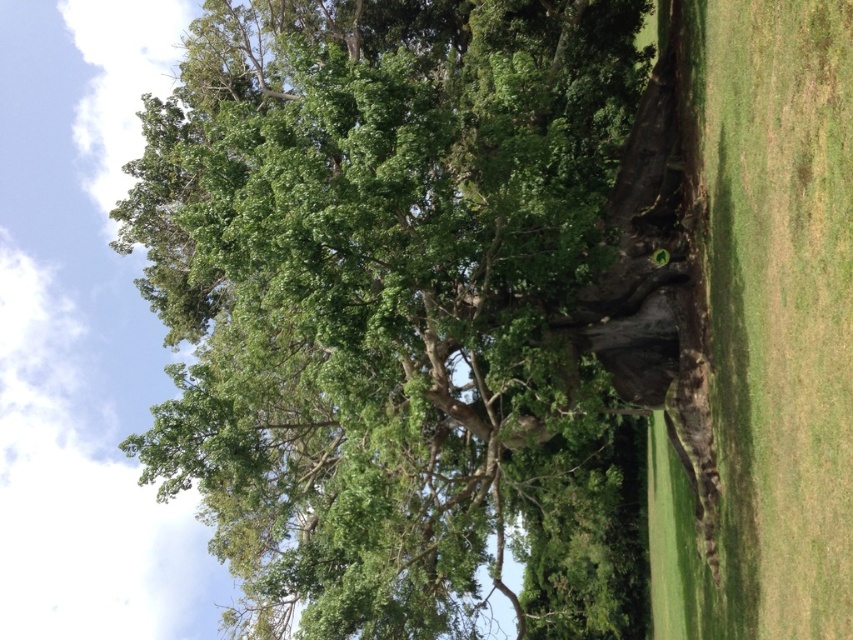
Is green leafy tree at center below green grass at right?

Yes, green leafy tree at center is below green grass at right.

Is green leafy tree at center smaller than green grass at right?

Actually, green leafy tree at center might be larger than green grass at right.

The width and height of the screenshot is (853, 640). What do you see at coordinates (393, 308) in the screenshot? I see `green leafy tree at center` at bounding box center [393, 308].

This screenshot has height=640, width=853. Find the location of `green leafy tree at center`. green leafy tree at center is located at coordinates (393, 308).